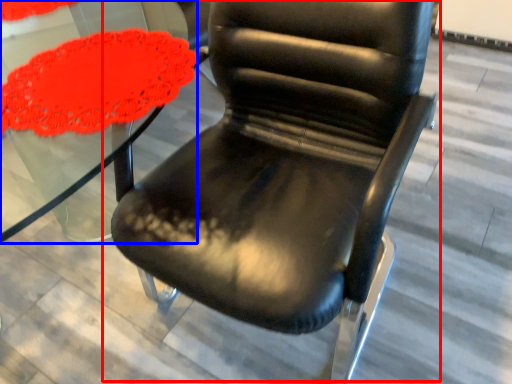
Question: Which point is further to the camera, chair (highlighted by a red box) or round table (highlighted by a blue box)?

Choices:
 (A) chair
 (B) round table

Answer: (B)